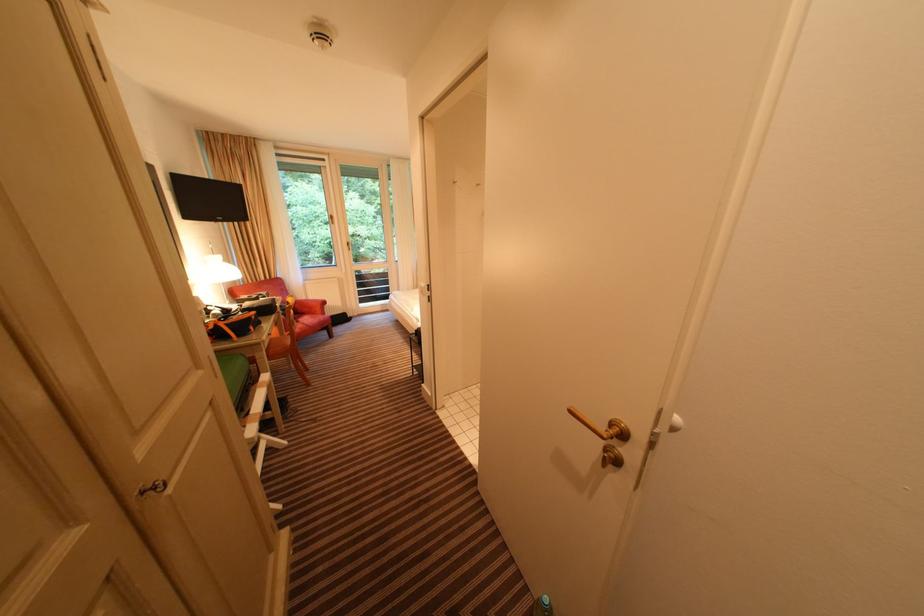
Find where to resting arm the red chair armrest. Please return your answer as a coordinate pair (x, y).

(311, 307)